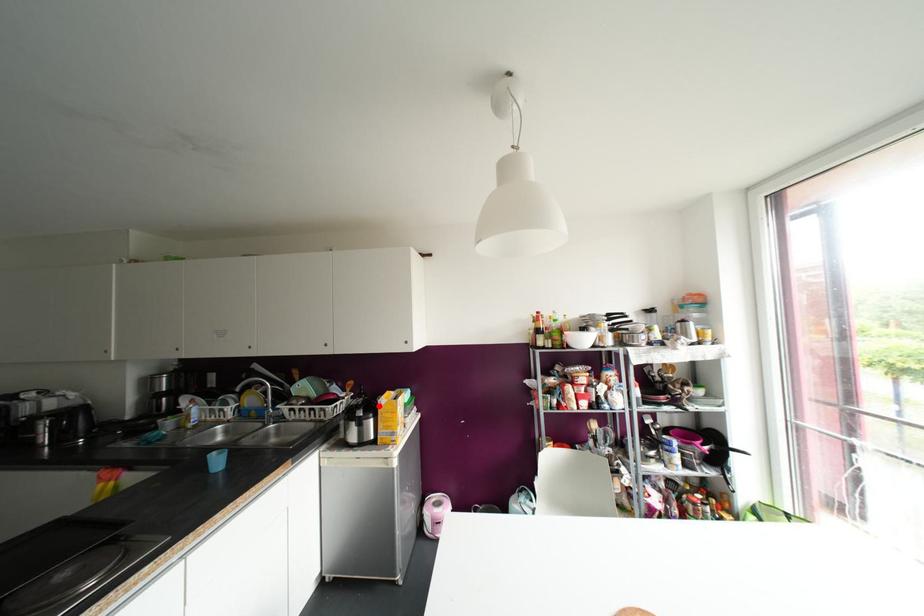
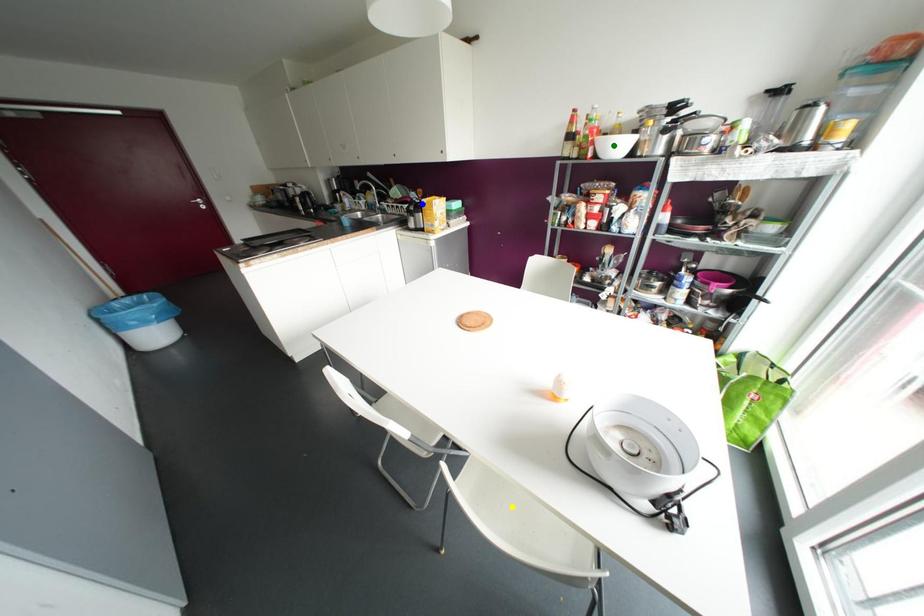
Question: I am providing you with two images of the same scene from different viewpoints. A red point is marked on the first image. You are given multiple points on the second image. Which mark in image 2 goes with the point in image 1?

Choices:
 (A) green point
 (B) yellow point
 (C) blue point

Answer: (C)